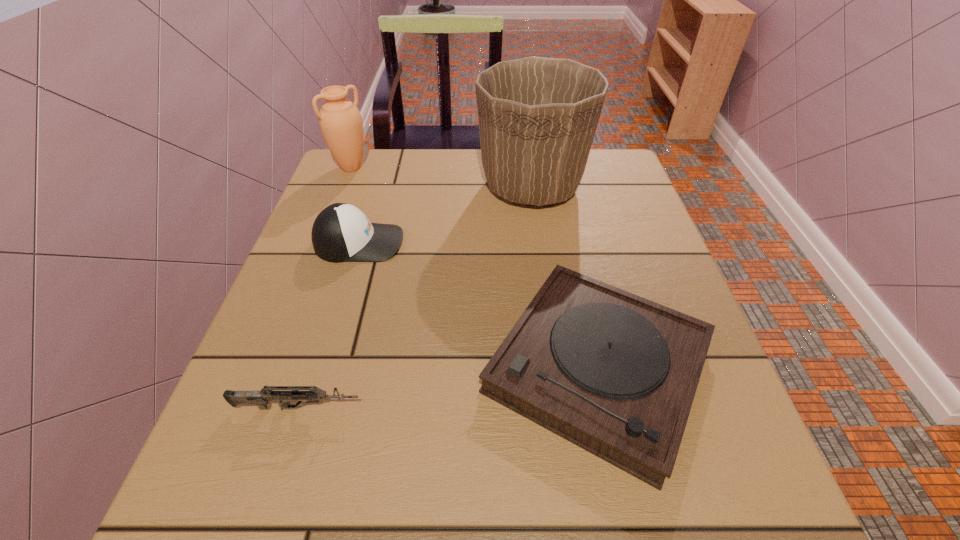
At what (x,y) coordinates should I click in order to perform the action: click on the tallest object. Please return your answer as a coordinate pair (x, y). Image resolution: width=960 pixels, height=540 pixels. Looking at the image, I should click on (537, 116).

Locate an element on the screen. the fourth shortest object is located at coordinates (340, 121).

At what (x,y) coordinates should I click in order to perform the action: click on the third shortest object. Please return your answer as a coordinate pair (x, y). The image size is (960, 540). Looking at the image, I should click on (341, 232).

Locate an element on the screen. Image resolution: width=960 pixels, height=540 pixels. the third farthest object is located at coordinates (341, 232).

Identify the location of gun. This screenshot has height=540, width=960. (261, 398).

In order to click on phonograph record in this screenshot , I will do `click(616, 374)`.

You are a GUI agent. You are given a task and a screenshot of the screen. Output one action in this format:
    pyautogui.click(x=<x>, y=<y>)
    Task: Click on the blank space located on the left of the flowerpot
    
    Given the screenshot: What is the action you would take?
    pyautogui.click(x=381, y=186)

Locate an element on the screen. The image size is (960, 540). vacant area situated on the right of the second tallest object is located at coordinates point(513,167).

Locate an element on the screen. vacant space situated on the front panel of the third farthest object is located at coordinates (549, 242).

This screenshot has width=960, height=540. I want to click on vacant space located 0.360m aimed along the barrel of the gun, so click(594, 408).